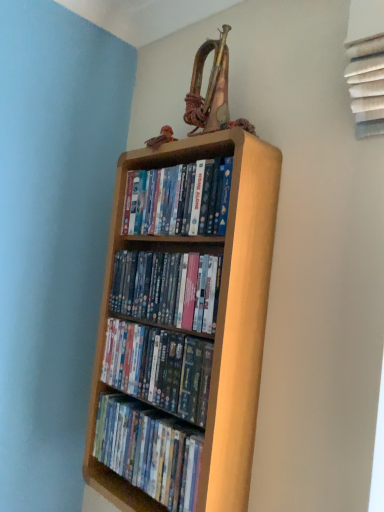
Question: Is matte plastic dvds at center, acting as the second book starting from the bottom, wider or thinner than wooden shelf at center, the 4th book in the top-to-bottom sequence?

Choices:
 (A) thin
 (B) wide

Answer: (B)

Question: From the image's perspective, is matte plastic dvds at center, acting as the second book starting from the bottom, positioned above or below wooden shelf at center, the first book when ordered from bottom to top?

Choices:
 (A) above
 (B) below

Answer: (A)

Question: Estimate the real-world distances between objects in this image. Which object is closer to the wooden shelf at center, the 3th book positioned from the bottom?

Choices:
 (A) light wood bookcase at center
 (B) matte plastic dvds at center, positioned as the third book in top-to-bottom order
 (C) matte wooden shelf at upper center, acting as the fourth book starting from the bottom
 (D) wooden shelf at center, the first book when ordered from bottom to top

Answer: (B)

Question: Estimate the real-world distances between objects in this image. Which object is closer to the light wood bookcase at center?

Choices:
 (A) matte wooden shelf at upper center, acting as the fourth book starting from the bottom
 (B) wooden shelf at center, arranged as the second book when viewed from the top
 (C) matte plastic dvds at center, positioned as the third book in top-to-bottom order
 (D) wooden shelf at center, the first book when ordered from bottom to top

Answer: (B)